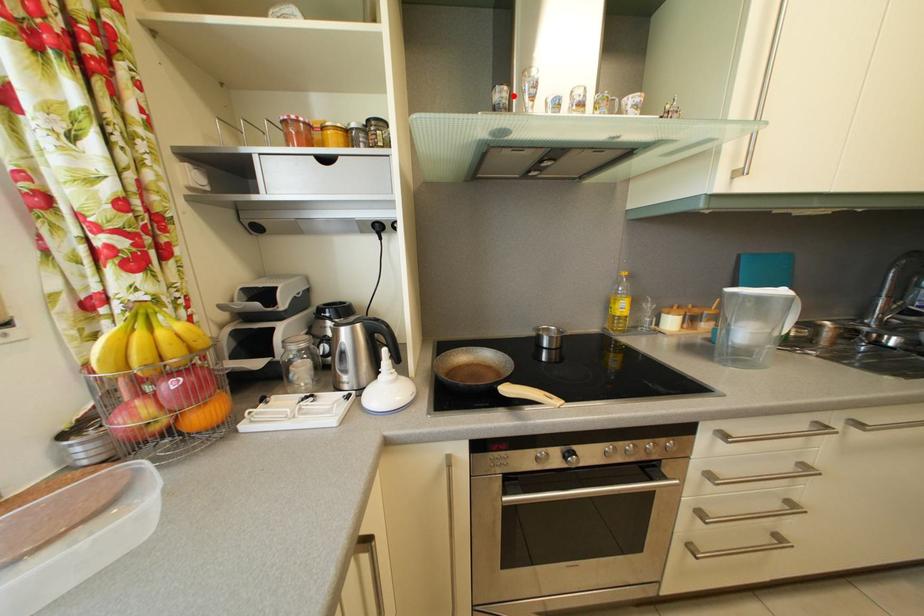
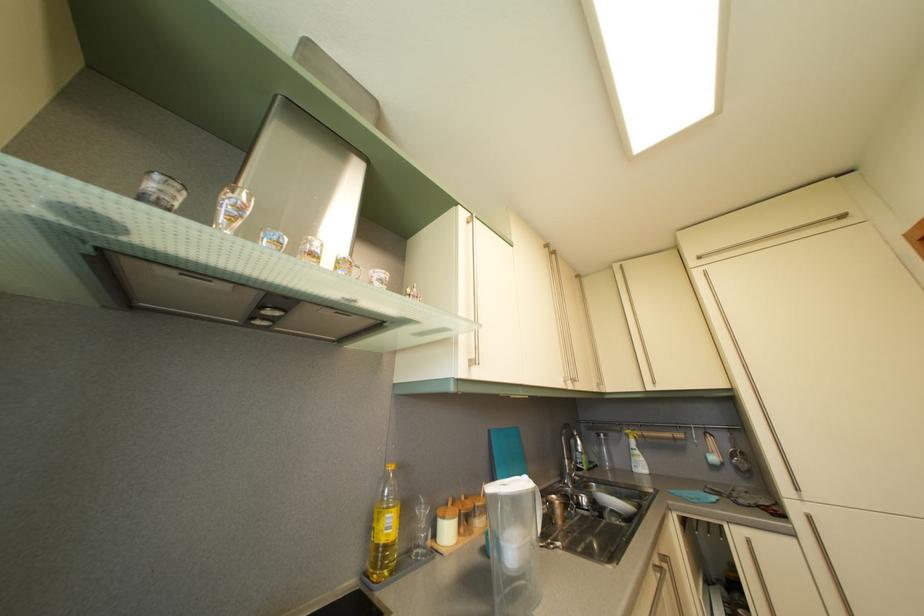
In the second image, find the point that corresponds to the highlighted location in the first image.

(186, 193)